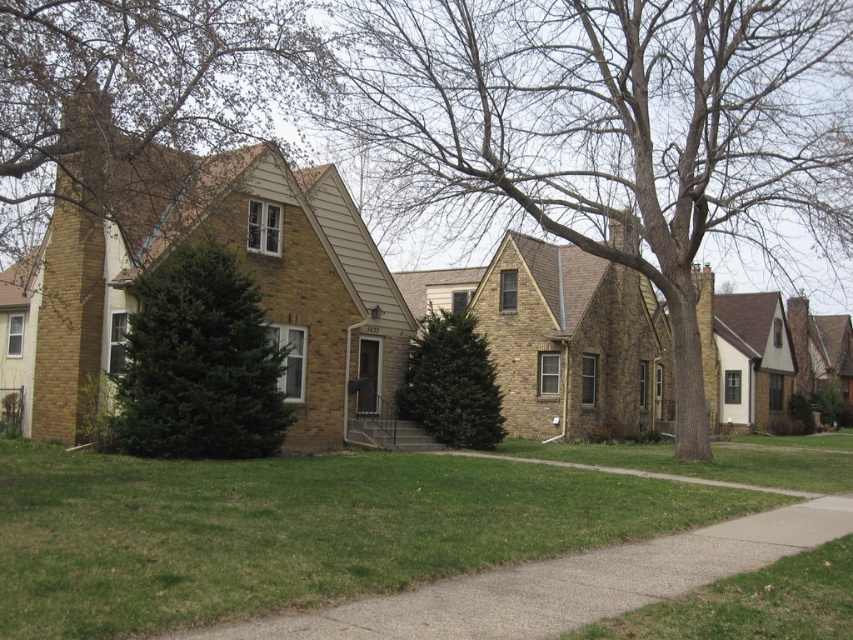
Does green matte tree at center appear on the right side of green grass at lower right?

In fact, green matte tree at center is to the left of green grass at lower right.

Who is lower down, green matte tree at center or green grass at lower right?

Positioned lower is green grass at lower right.

Identify the location of green matte tree at center. Image resolution: width=853 pixels, height=640 pixels. (199, 364).

Locate an element on the screen. The height and width of the screenshot is (640, 853). green matte tree at center is located at coordinates (199, 364).

Is brown textured tree at center smaller than gray concrete sidewalk at lower center?

Actually, brown textured tree at center might be larger than gray concrete sidewalk at lower center.

Is brown textured tree at center below gray concrete sidewalk at lower center?

No.

Does point (727, 141) come farther from viewer compared to point (213, 634)?

Yes.

Where is `brown textured tree at center`? This screenshot has height=640, width=853. brown textured tree at center is located at coordinates (602, 131).

Is point (616, 90) positioned after point (463, 380)?

No, it is in front of (463, 380).

Can you confirm if brown textured tree at center is positioned to the right of green textured evergreen tree at center?

Correct, you'll find brown textured tree at center to the right of green textured evergreen tree at center.

Between point (456, 42) and point (473, 445), which one is positioned in front?

Point (456, 42) is in front.

Locate an element on the screen. The width and height of the screenshot is (853, 640). brown textured tree at center is located at coordinates (602, 131).